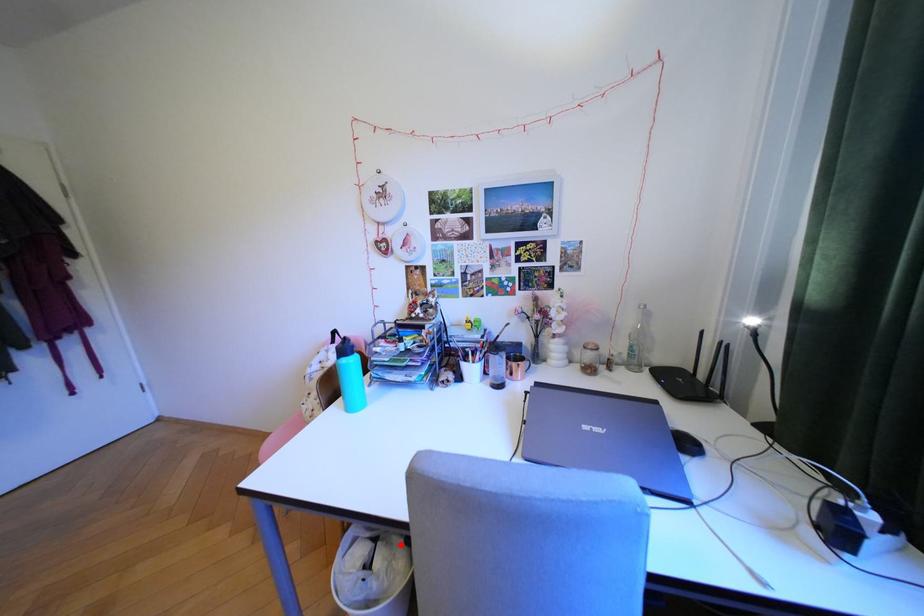
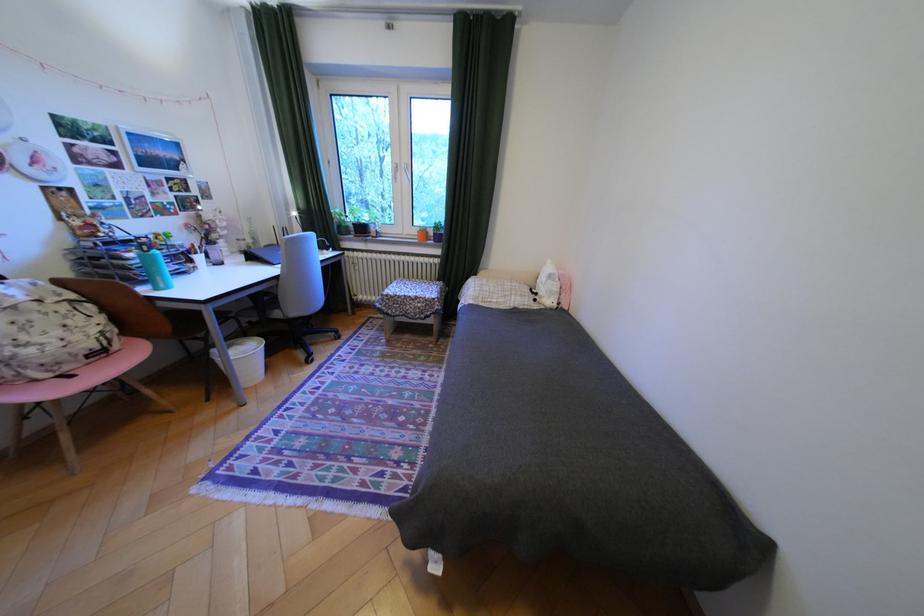
Question: I am providing you with two images of the same scene from different viewpoints. Image1 has a red point marked. In image2, the corresponding 3D location appears at what relative position? Reply with the corresponding letter.

Choices:
 (A) Closer
 (B) Farther

Answer: (A)